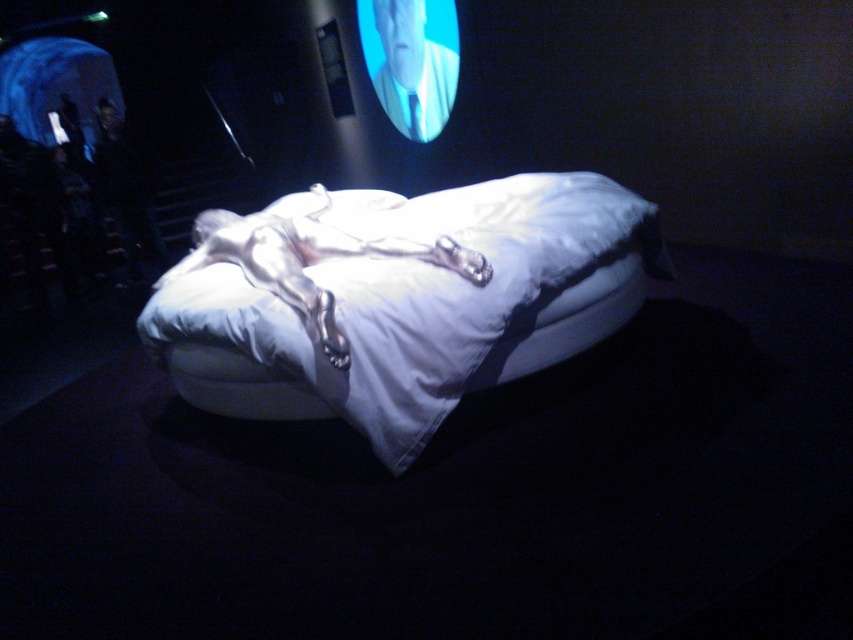
You are trying to decide where to place a new nightstand in your room. The white fabric bed at center and the silver metallic sleeping bag at center are both at the center of the room. Which object is positioned to the right when viewed from the front?

The white fabric bed at center is to the right of the silver metallic sleeping bag at center.

You are a photographer adjusting your camera to focus on two points in the scene. The first point is at coordinates point (494,208) and the second is at point (308,300). Which point should you focus on first if you want to capture both points clearly in your photo?

You should focus on point (494,208) first because it is closer to the camera than point (308,300), ensuring both points are in focus when using a shallow depth of field.